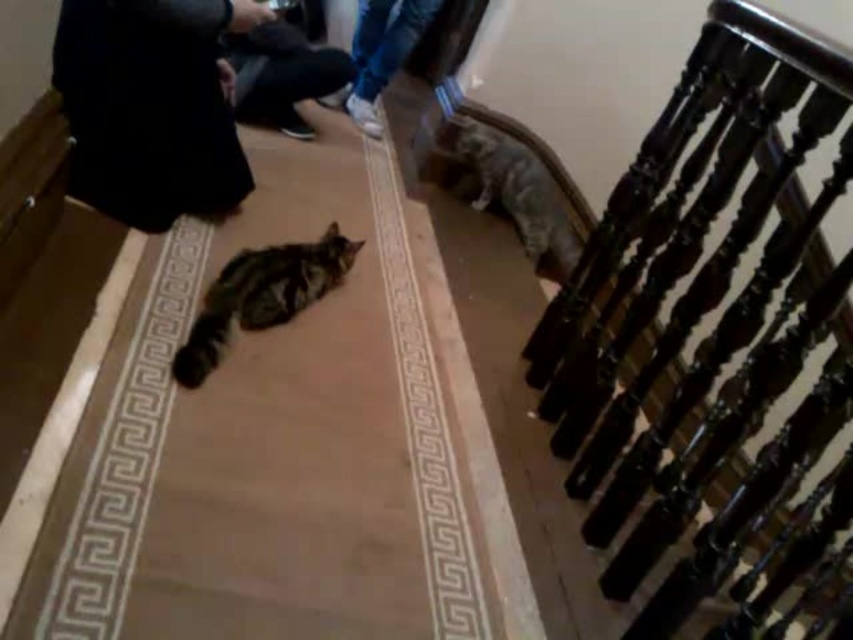
You are holding a 4.5 feet long pole and want to reach the black fabric at upper left. Can you reach it with your pole?

The black fabric at upper left is 4.73 feet away from the viewer. Since the pole is only 4.5 feet long, you cannot reach the black fabric at upper left with it.

You are a cat owner who wants to place a new toy for your cat. The toy needs to be placed in a spot that is closer to the tabby fur cat at center than to the denim pants at upper center. Where should you place the toy?

The toy should be placed closer to the tabby fur cat at center since it is already nearer to that location compared to the denim pants at upper center.

You are a photographer trying to capture both the tabby fur cat at center and the denim pants at upper center in a single frame. Based on their sizes, which object should you focus on first to ensure both fit in the photo?

The tabby fur cat at center has a lesser width compared to denim pants at upper center, so you should focus on positioning the denim pants at upper center first since it is wider and requires more space in the frame to ensure both objects are captured properly.